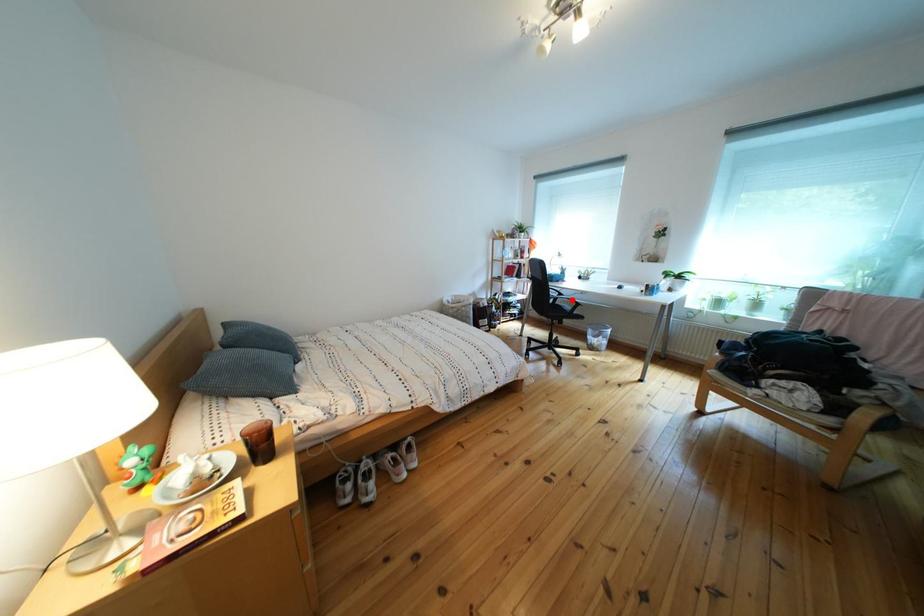
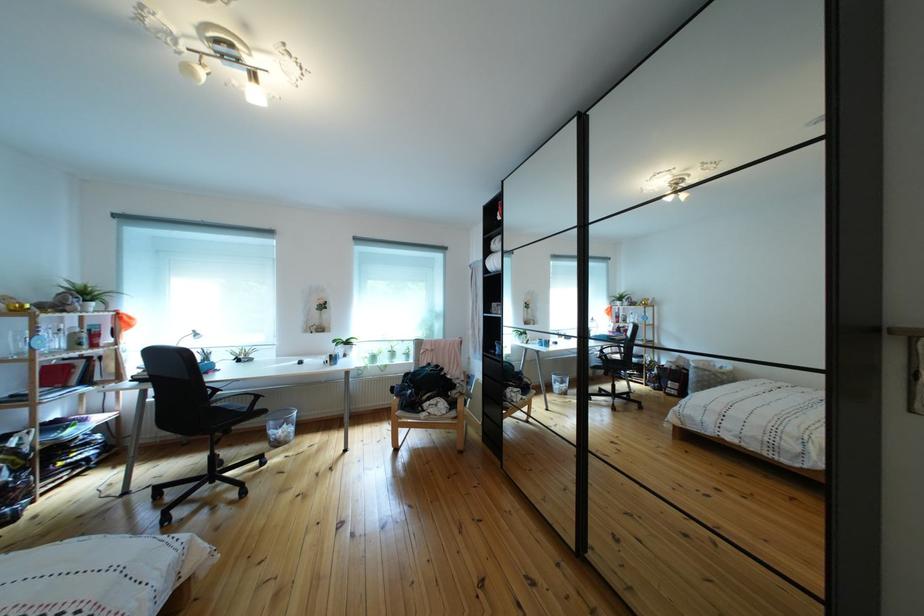
Find the pixel in the second image that matches the highlighted location in the first image.

(227, 395)